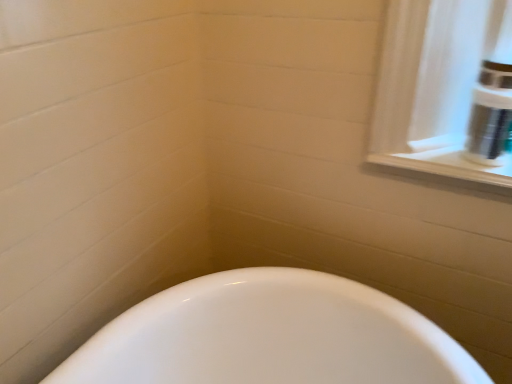
This screenshot has height=384, width=512. Describe the element at coordinates (490, 114) in the screenshot. I see `metallic silver container at upper right` at that location.

This screenshot has width=512, height=384. Find the location of `metallic silver container at upper right`. metallic silver container at upper right is located at coordinates (490, 114).

At what (x,y) coordinates should I click in order to perform the action: click on metallic silver container at upper right. Please return your answer as a coordinate pair (x, y). Looking at the image, I should click on (490, 114).